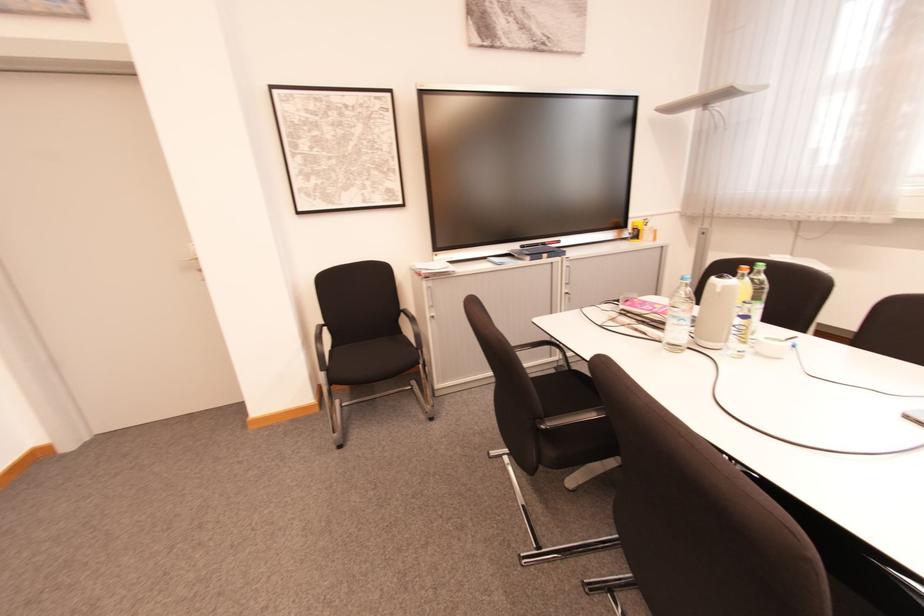
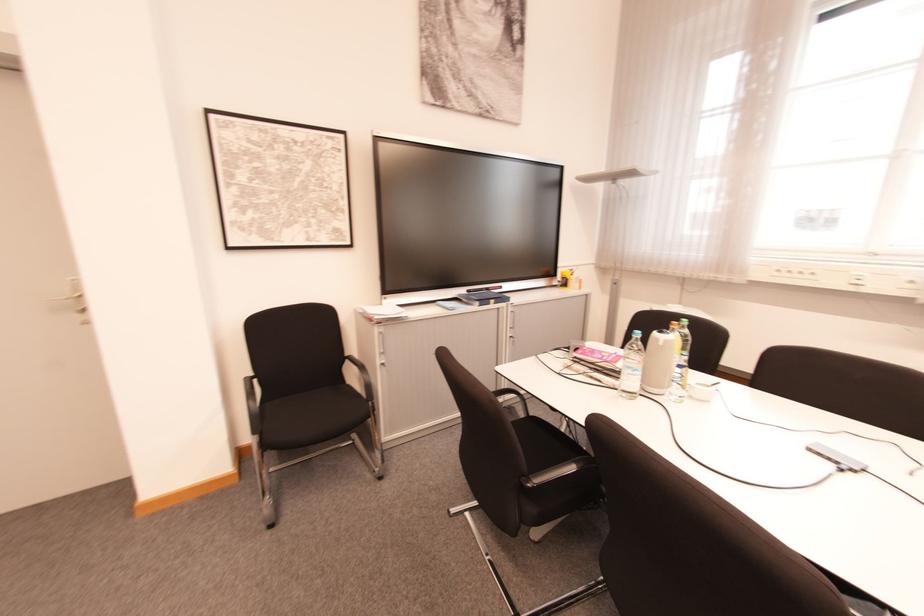
Question: The first image is from the beginning of the video and the second image is from the end. How did the camera likely rotate when shooting the video?

Choices:
 (A) Left
 (B) Right
 (C) Up
 (D) Down

Answer: (B)